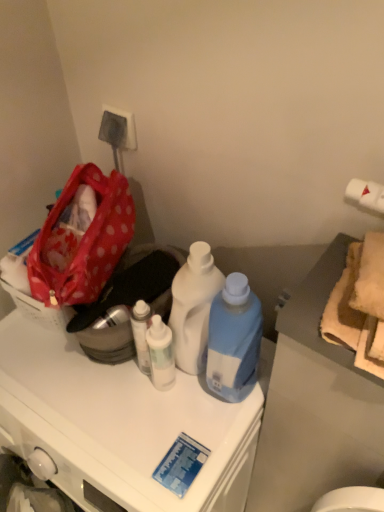
Find the location of `free space in front of white plastic bottle at center, marked as the second bottle in a right-to-left arrangement`. free space in front of white plastic bottle at center, marked as the second bottle in a right-to-left arrangement is located at coordinates (176, 430).